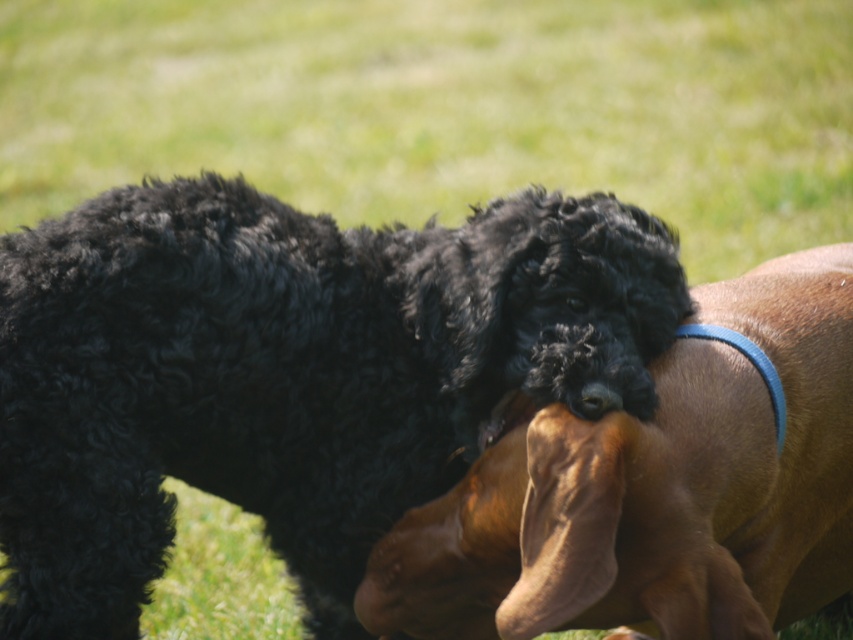
Question: Which point is farther to the camera?

Choices:
 (A) (260, 472)
 (B) (386, 598)

Answer: (A)

Question: Does black curly fur dog at center appear on the right side of black curly fur at center?

Choices:
 (A) no
 (B) yes

Answer: (A)

Question: Does black curly fur dog at center have a lesser width compared to black curly fur at center?

Choices:
 (A) yes
 (B) no

Answer: (B)

Question: Can you confirm if black curly fur dog at center is bigger than black curly fur at center?

Choices:
 (A) no
 (B) yes

Answer: (A)

Question: Which point appears closest to the camera in this image?

Choices:
 (A) (315, 477)
 (B) (705, 554)

Answer: (B)